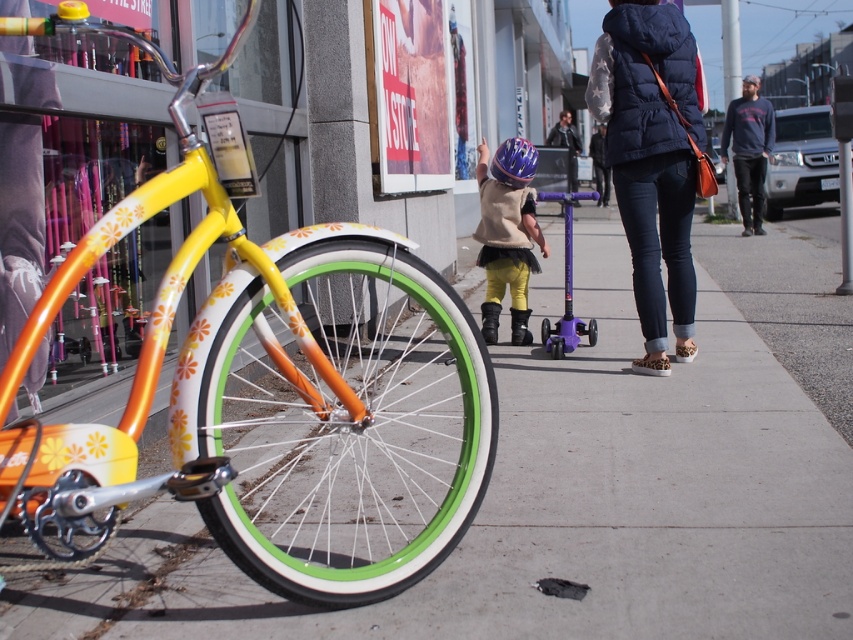
Question: From the image, what is the correct spatial relationship of matte purple helmet at center in relation to dark blue puffer jacket at center?

Choices:
 (A) right
 (B) left

Answer: (B)

Question: Estimate the real-world distances between objects in this image. Which object is farther from the floral painted bicycle at left?

Choices:
 (A) dark blue puffer jacket at center
 (B) shiny purple helmet at center
 (C) concrete sidewalk at center

Answer: (A)

Question: Can you confirm if dark blue puffer vest at center is smaller than dark blue sweater at right?

Choices:
 (A) no
 (B) yes

Answer: (B)

Question: Which point is closer to the camera?

Choices:
 (A) floral painted bicycle at left
 (B) concrete sidewalk at center
 (C) dark blue puffer vest at center
 (D) dark blue puffer jacket at center

Answer: (A)

Question: Can you confirm if dark blue puffer vest at center is positioned below dark blue sweater at right?

Choices:
 (A) no
 (B) yes

Answer: (B)

Question: Which of these objects is positioned closest to the floral painted bicycle at left?

Choices:
 (A) dark blue puffer vest at center
 (B) shiny purple helmet at center
 (C) dark blue puffer jacket at center

Answer: (A)